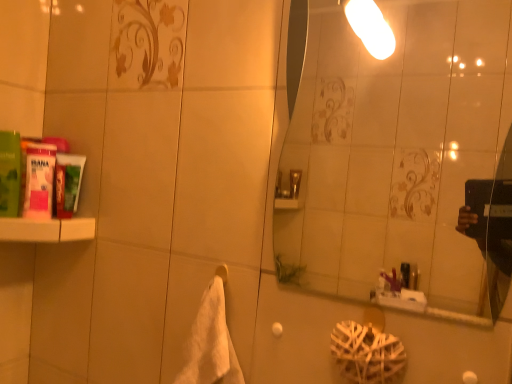
Question: Considering the relative sizes of white soft towel at center and transparent glass mirror at upper center in the image provided, is white soft towel at center taller than transparent glass mirror at upper center?

Choices:
 (A) no
 (B) yes

Answer: (A)

Question: Are white soft towel at center and transparent glass mirror at upper center beside each other?

Choices:
 (A) yes
 (B) no

Answer: (B)

Question: Considering the relative positions of white soft towel at center and transparent glass mirror at upper center in the image provided, is white soft towel at center to the right of transparent glass mirror at upper center from the viewer's perspective?

Choices:
 (A) yes
 (B) no

Answer: (B)

Question: From the image's perspective, is white soft towel at center on top of transparent glass mirror at upper center?

Choices:
 (A) no
 (B) yes

Answer: (A)

Question: Is white soft towel at center thinner than transparent glass mirror at upper center?

Choices:
 (A) yes
 (B) no

Answer: (B)

Question: From a real-world perspective, is white soft towel at center positioned over transparent glass mirror at upper center based on gravity?

Choices:
 (A) yes
 (B) no

Answer: (B)

Question: Can you confirm if white soft towel at center is positioned to the left of white matte towel bar at lower center?

Choices:
 (A) no
 (B) yes

Answer: (B)

Question: Is white matte towel bar at lower center surrounded by white soft towel at center?

Choices:
 (A) yes
 (B) no

Answer: (B)

Question: From a real-world perspective, is white soft towel at center positioned over white matte towel bar at lower center based on gravity?

Choices:
 (A) no
 (B) yes

Answer: (A)

Question: Could you tell me if white soft towel at center is turned towards white matte towel bar at lower center?

Choices:
 (A) yes
 (B) no

Answer: (B)

Question: Is white soft towel at center further to the viewer compared to white matte towel bar at lower center?

Choices:
 (A) yes
 (B) no

Answer: (B)

Question: Is white soft towel at center not near white matte towel bar at lower center?

Choices:
 (A) no
 (B) yes

Answer: (A)

Question: Is the surface of white matte shelf at left in direct contact with green matte tube at left, the first mouthwash in the right-to-left sequence?

Choices:
 (A) no
 (B) yes

Answer: (B)